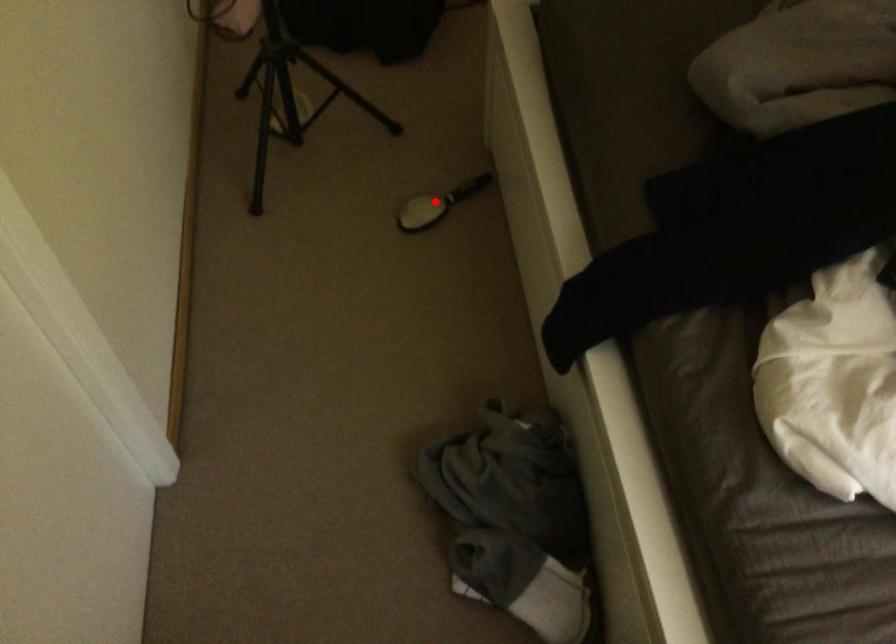
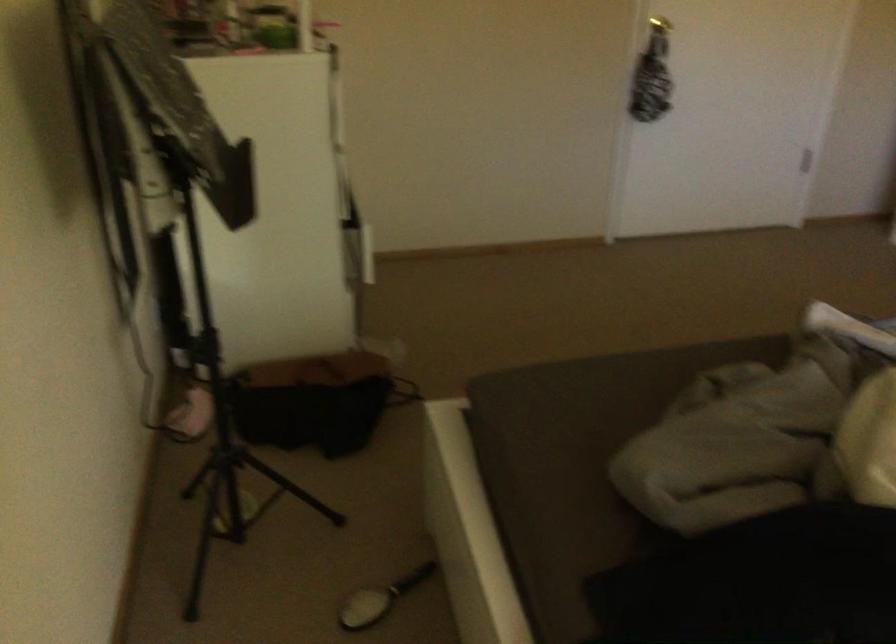
The point at the highlighted location is marked in the first image. Where is the corresponding point in the second image?

(380, 599)